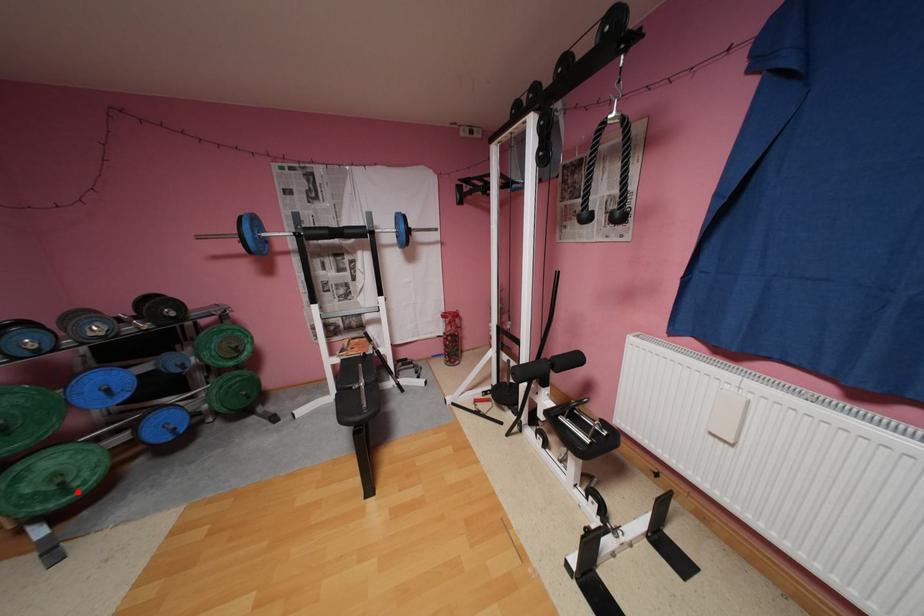
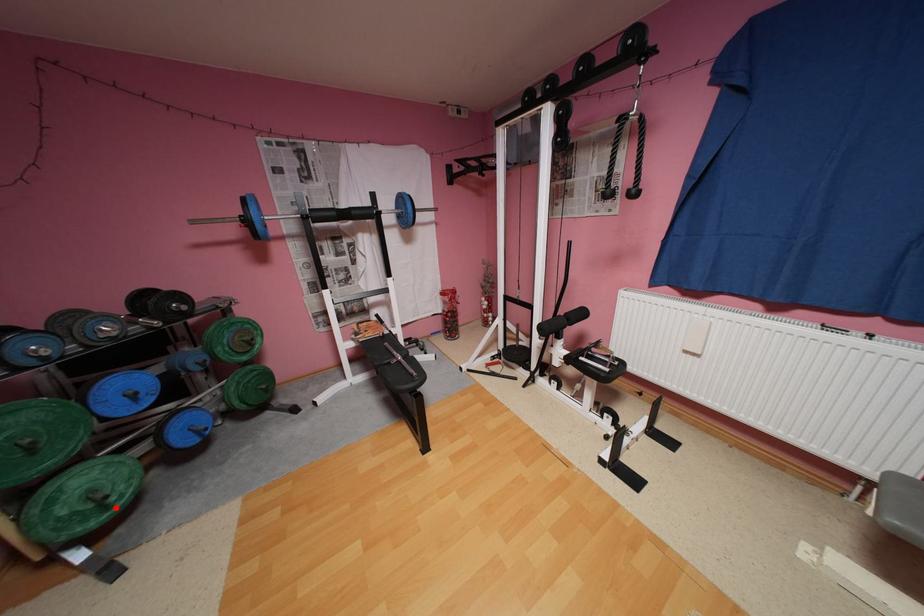
I am providing you with two images of the same scene from different viewpoints. A red point is marked on the first image and another point is marked on the second image. Are the points marked in image1 and image2 representing the same 3D position?

Yes